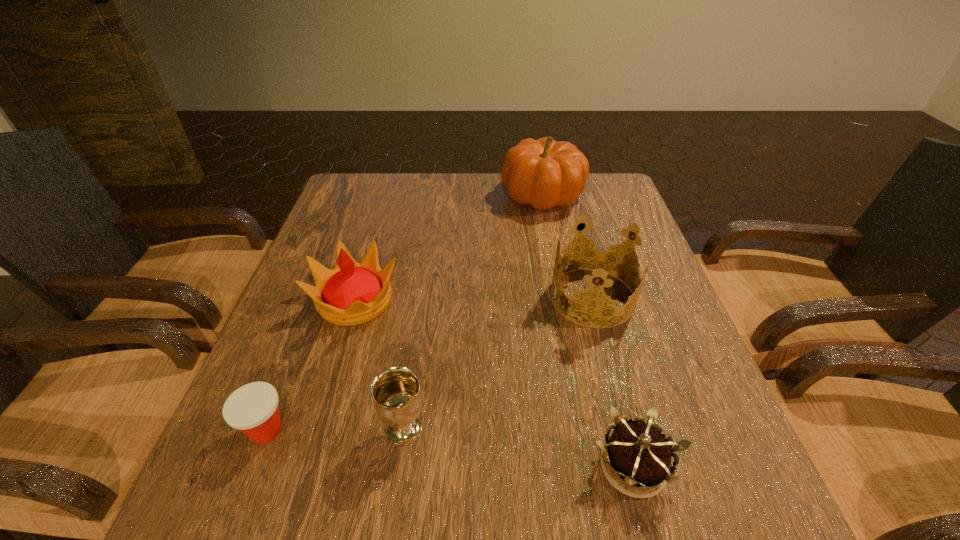
Locate which object ranks in proximity to the leftmost crown. Please provide its 2D coordinates. Your answer should be formatted as a tuple, i.e. [(x, y)], where the tuple contains the x and y coordinates of a point satisfying the conditions above.

[(253, 409)]

Where is `crown object that ranks as the closest to the third shortest object`? crown object that ranks as the closest to the third shortest object is located at coordinates (352, 293).

The image size is (960, 540). In order to click on the third closest crown relative to the pumpkin in this screenshot , I will do `click(635, 453)`.

Where is `vacant region that satisfies the following two spatial constraints: 1. on the front side of the fourth tallest object; 2. on the left side of the leftmost crown`? Image resolution: width=960 pixels, height=540 pixels. vacant region that satisfies the following two spatial constraints: 1. on the front side of the fourth tallest object; 2. on the left side of the leftmost crown is located at coordinates (317, 429).

Image resolution: width=960 pixels, height=540 pixels. What are the coordinates of `free space in the image that satisfies the following two spatial constraints: 1. on the front side of the leftmost crown; 2. on the right side of the nearest crown` in the screenshot? It's located at (306, 466).